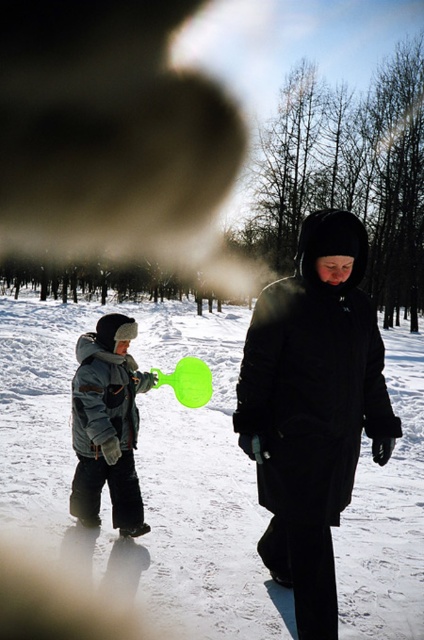
You are a photographer trying to capture the child in the matte gray snowsuit at left without the white fluffy snow at center blocking the view. Can you adjust your camera angle to avoid the snow?

The white fluffy snow at center is positioned under the matte gray snowsuit at left, so adjusting the camera angle upwards might allow you to capture the child without the snow blocking the view.

You are standing in the snowy landscape and want to place a small flag at the closest point between point (387, 572) and point (139, 532). Which point should you place the flag closer to?

The flag should be placed closer to point (387, 572) because it is closer to the viewer than point (139, 532).